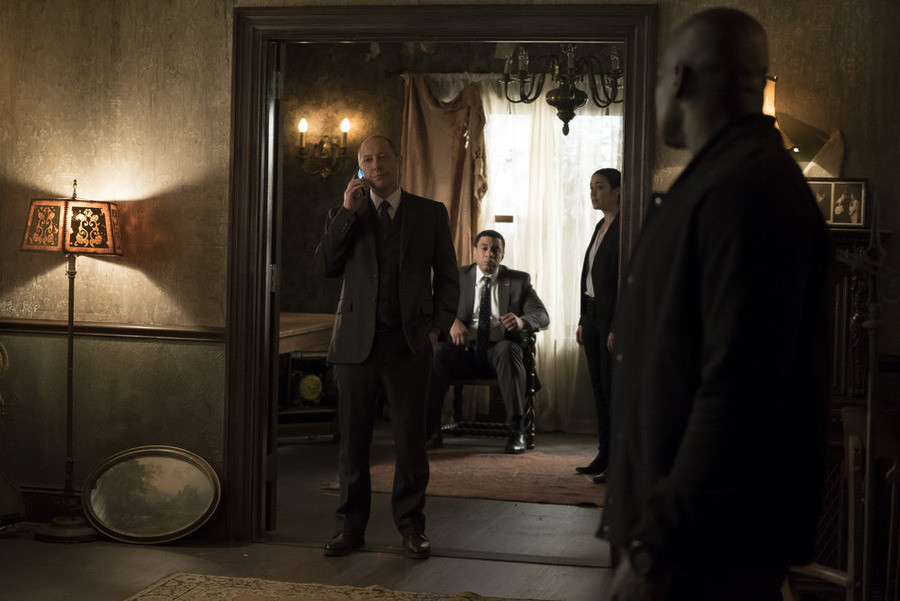
Find the location of `floor`. floor is located at coordinates (504, 575).